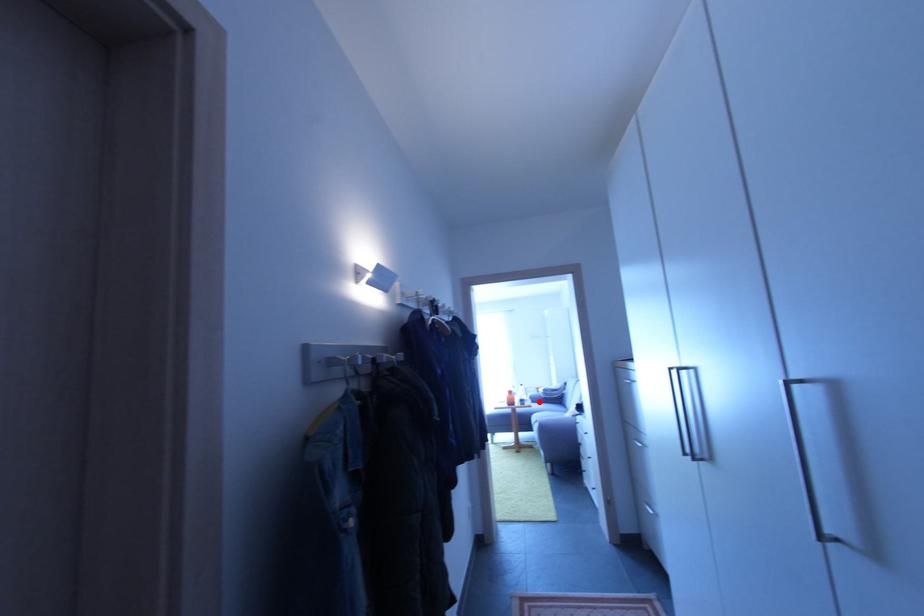
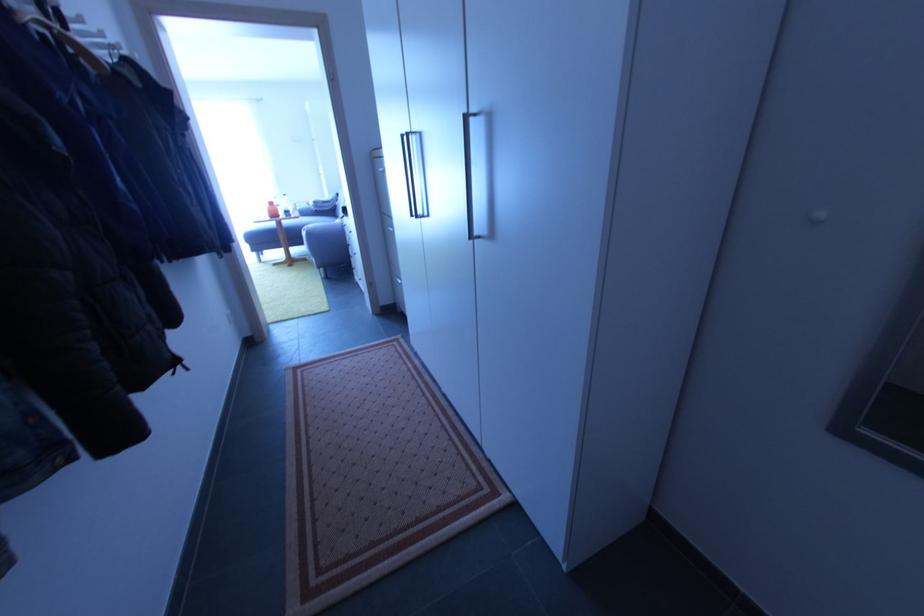
Question: I am providing you with two images of the same scene from different viewpoints. A red point is shown in image1. For the corresponding object point in image2, is it positioned nearer or farther from the camera?

Choices:
 (A) Nearer
 (B) Farther

Answer: (A)